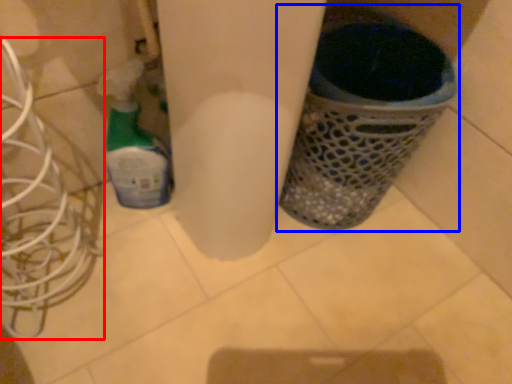
Question: Among these objects, which one is nearest to the camera, wire (highlighted by a red box) or waste container (highlighted by a blue box)?

Choices:
 (A) wire
 (B) waste container

Answer: (A)